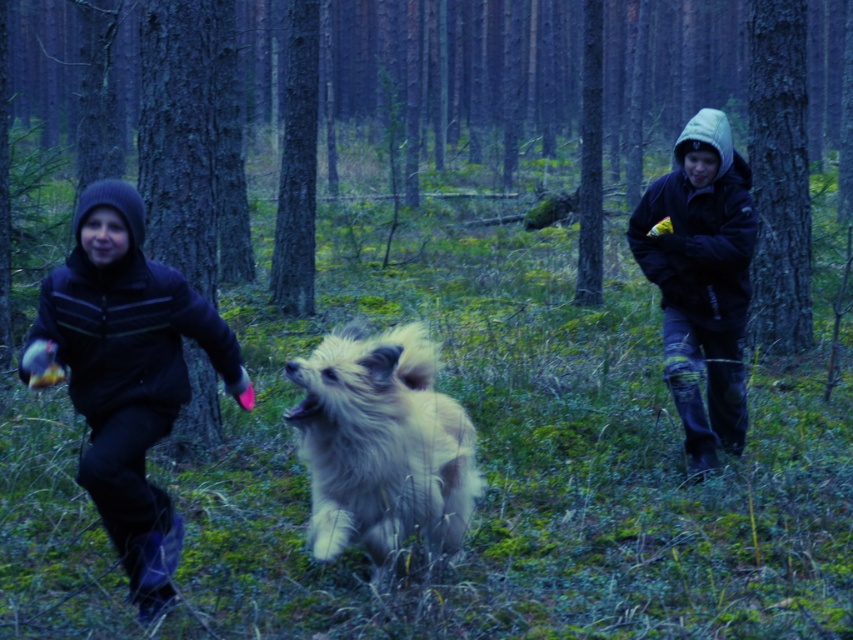
You are a hiker trying to decide whether to let your fluffy white dog at center chase after a squirrel that just ran behind the dark blue hooded jacket at right. Based on their sizes, can the squirrel easily hide behind the jacket?

The fluffy white dog at center is bigger than the dark blue hooded jacket at right, so the squirrel might not be able to hide easily behind the jacket since the jacket is smaller than the dog.

You are standing in the forest and see two points marked in the scene. The first point is at coordinates point [38,342] and the second is at point [734,285]. Which point is closer to you?

Point [38,342] is in front of point [734,285], so it is closer to you.

From the picture: You are a hiker lost in a forest and see the black fleece jacket at left and the dark blue hooded jacket at right. Which jacket is closer to you if you are standing at the center of the image?

The black fleece jacket at left is closer to you because it is only 2.79 meters away from the dark blue hooded jacket at right, so whichever is closer depends on their positions from the center. Wait, the description says the distance between them is 2.79 meters, but the question is about which is closer to the observer at the center. Hmm, maybe I need to rephrase the answer based on the given data. Since the distance between the two jackets is 2.79 meters, but without knowing their exact positions relative